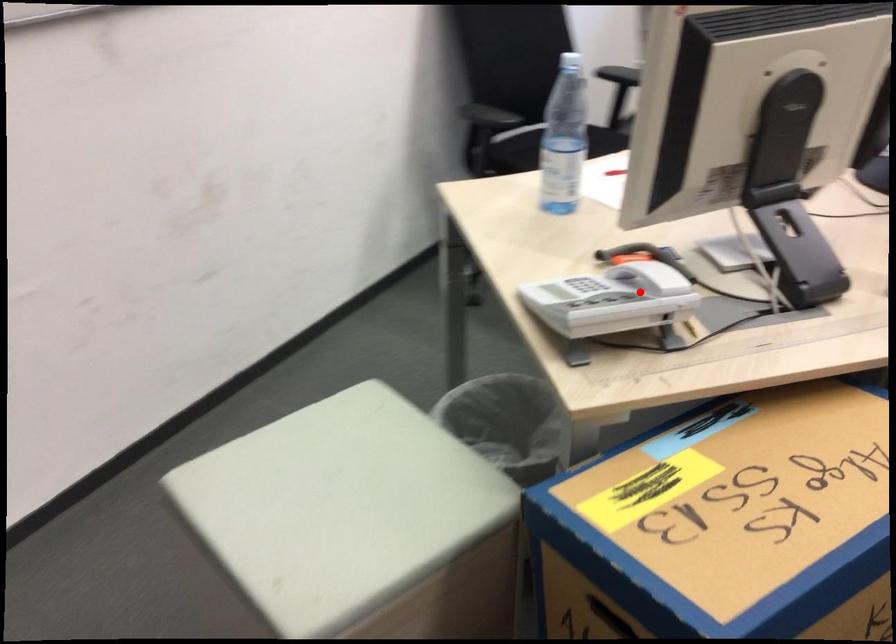
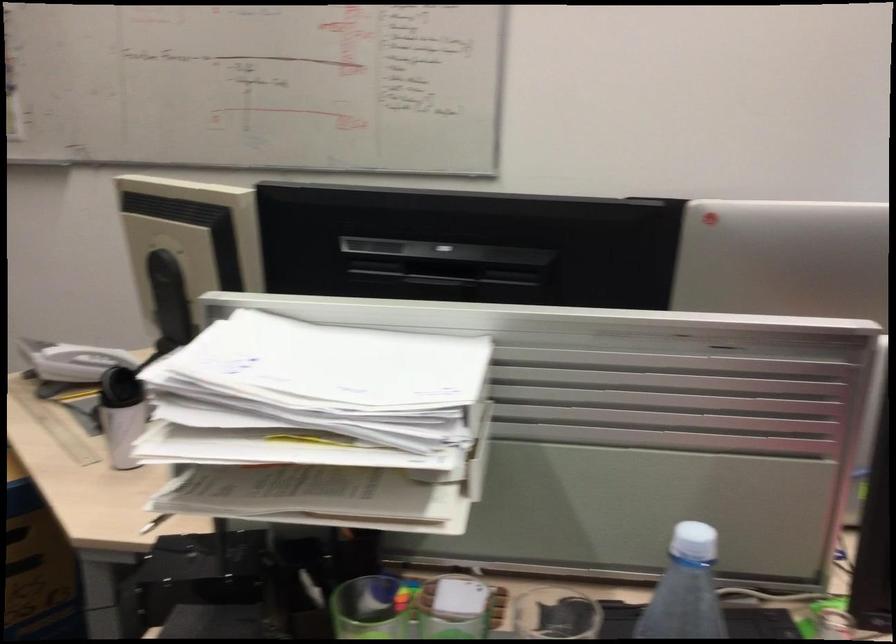
Find the pixel in the second image that matches the highlighted location in the first image.

(82, 362)